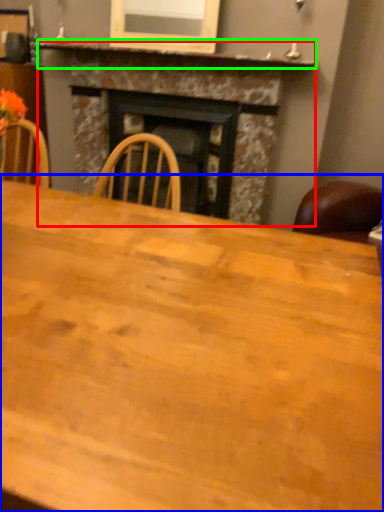
Question: Based on their relative distances, which object is nearer to fireplace (highlighted by a red box)? Choose from table (highlighted by a blue box) and mantle (highlighted by a green box).

Choices:
 (A) table
 (B) mantle

Answer: (B)